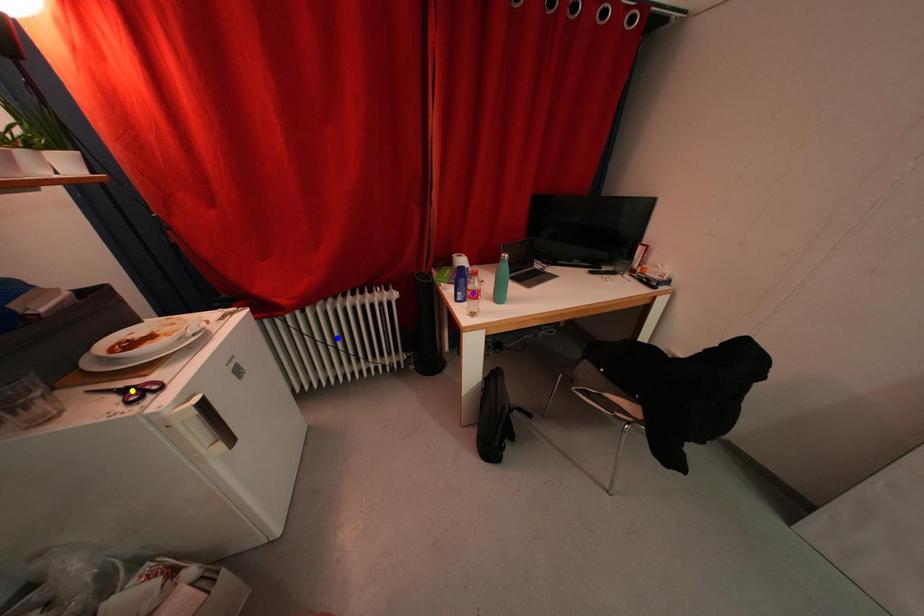
Order these from nearest to farthest:
purple point
yellow point
blue point

yellow point, purple point, blue point